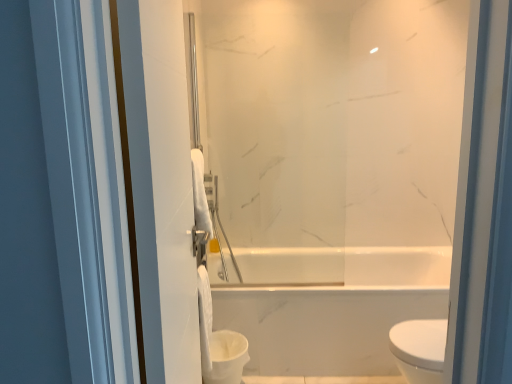
Question: Should I look upward or downward to see white plastic toilet bowl at lower left?

Choices:
 (A) up
 (B) down

Answer: (B)

Question: Is white matte toilet paper at center bigger than white glossy towel at left?

Choices:
 (A) no
 (B) yes

Answer: (A)

Question: Is white matte toilet paper at center to the right of white glossy towel at left from the viewer's perspective?

Choices:
 (A) no
 (B) yes

Answer: (A)

Question: Could you tell me if white matte toilet paper at center is turned towards white glossy towel at left?

Choices:
 (A) no
 (B) yes

Answer: (A)

Question: Is the position of white matte toilet paper at center more distant than that of white glossy towel at left?

Choices:
 (A) yes
 (B) no

Answer: (A)

Question: From the image's perspective, is white matte toilet paper at center under white glossy towel at left?

Choices:
 (A) yes
 (B) no

Answer: (A)

Question: Would you consider white matte toilet paper at center to be distant from white glossy towel at left?

Choices:
 (A) no
 (B) yes

Answer: (A)

Question: Does white matte toilet paper at center have a lesser height compared to white plastic toilet bowl at lower left?

Choices:
 (A) yes
 (B) no

Answer: (B)

Question: Is white matte toilet paper at center aimed at white plastic toilet bowl at lower left?

Choices:
 (A) no
 (B) yes

Answer: (A)

Question: From a real-world perspective, is white matte toilet paper at center over white plastic toilet bowl at lower left?

Choices:
 (A) yes
 (B) no

Answer: (A)

Question: Is white matte toilet paper at center oriented away from white plastic toilet bowl at lower left?

Choices:
 (A) yes
 (B) no

Answer: (B)

Question: Does white matte toilet paper at center have a larger size compared to white plastic toilet bowl at lower left?

Choices:
 (A) no
 (B) yes

Answer: (A)

Question: Considering the relative sizes of white matte toilet paper at center and white plastic toilet bowl at lower left in the image provided, is white matte toilet paper at center smaller than white plastic toilet bowl at lower left?

Choices:
 (A) no
 (B) yes

Answer: (B)

Question: Considering the relative sizes of white glossy towel at left and white plastic toilet bowl at lower left in the image provided, is white glossy towel at left shorter than white plastic toilet bowl at lower left?

Choices:
 (A) no
 (B) yes

Answer: (A)